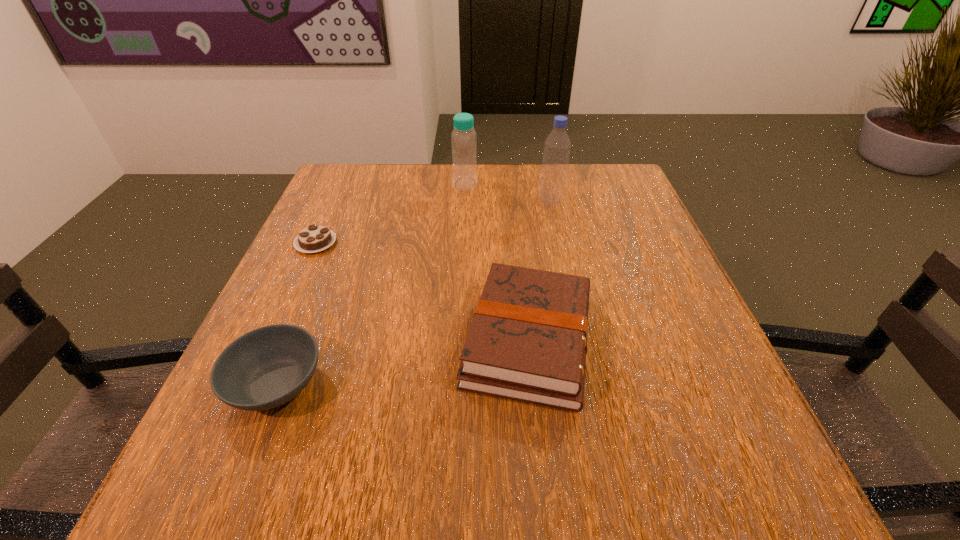
In order to click on free space between the third farthest object and the hardback book in this screenshot , I will do `click(422, 292)`.

Point out which object is positioned as the fourth nearest to the third farthest object. Please provide its 2D coordinates. Your answer should be formatted as a tuple, i.e. [(x, y)], where the tuple contains the x and y coordinates of a point satisfying the conditions above.

[(557, 146)]

Locate which object ranks third in proximity to the fourth nearest object. Please provide its 2D coordinates. Your answer should be formatted as a tuple, i.e. [(x, y)], where the tuple contains the x and y coordinates of a point satisfying the conditions above.

[(314, 238)]

In order to click on vacant area that satisfies the following two spatial constraints: 1. on the back side of the fourth shortest object; 2. on the left side of the fourth tallest object in this screenshot , I will do `click(357, 184)`.

Image resolution: width=960 pixels, height=540 pixels. Identify the location of vacant area in the image that satisfies the following two spatial constraints: 1. on the front side of the shorter bottle; 2. on the right side of the hardback book. [x=458, y=341].